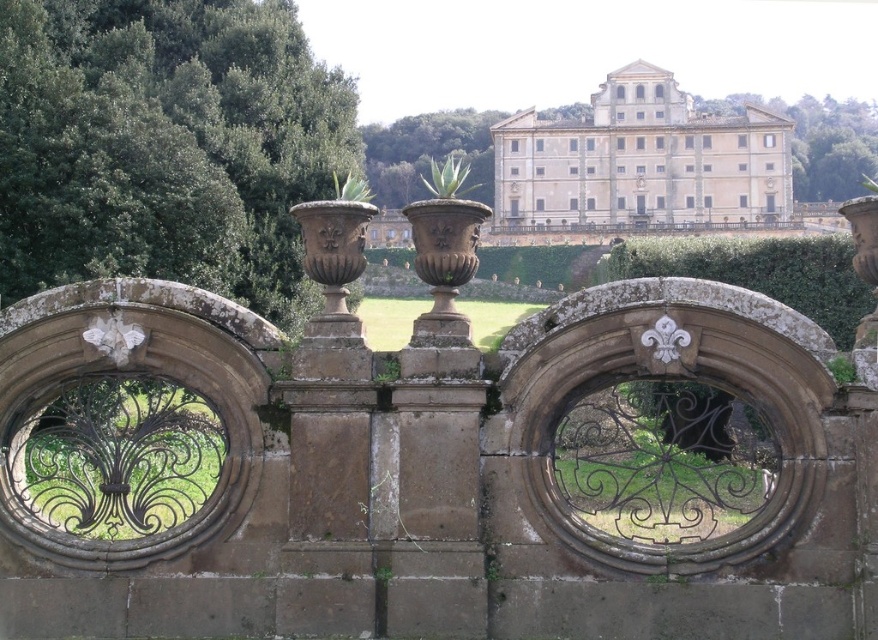
You are an architect planning to install a new statue in the courtyard. The statue will be placed between the white stone building at center and the green leafy tree at center. Considering their heights, which one will the statue be closer in height to?

The white stone building at center has a lesser height compared to the green leafy tree at center, so the statue will be closer in height to the white stone building at center.

Looking at this image, you are standing at the point marked as point (641, 161) in the image. What do you see directly in front of you?

You see the white stone building at center directly in front of you.